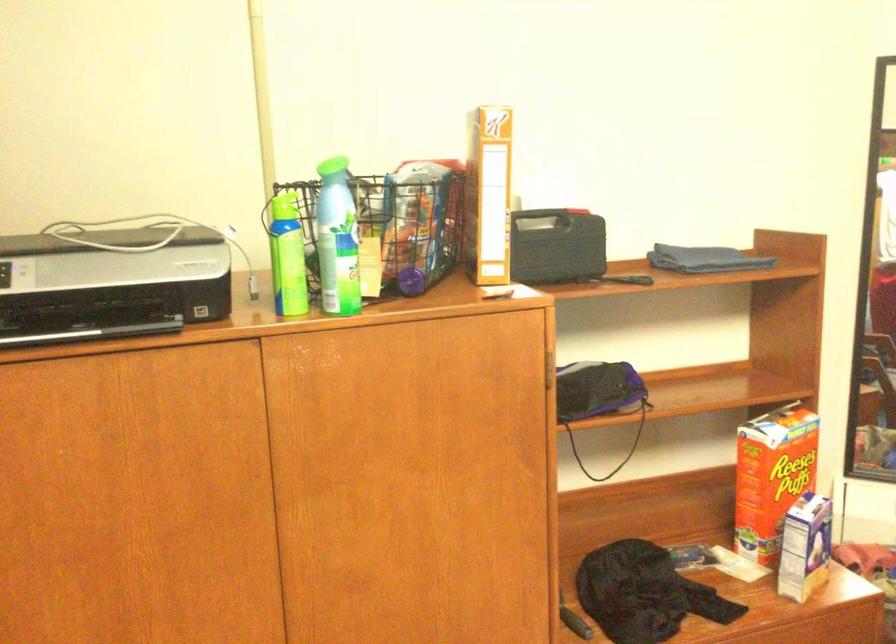
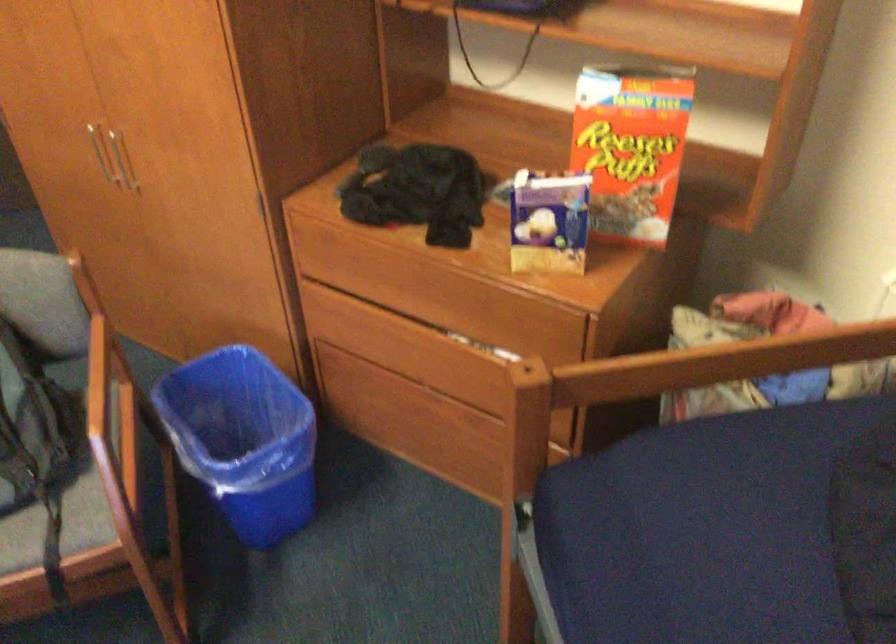
Where in the second image is the point corresponding to pixel 803 459 from the first image?

(631, 146)